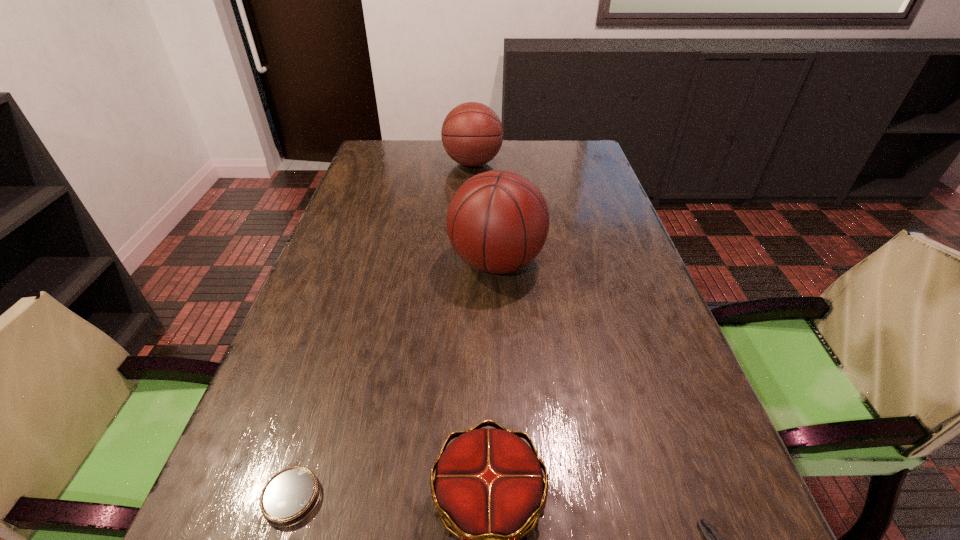
You are a GUI agent. You are given a task and a screenshot of the screen. Output one action in this format:
    pyautogui.click(x=<x>, y=<y>)
    Task: Click on the free space at the far edge
    Image resolution: width=960 pixels, height=540 pixels.
    Given the screenshot: What is the action you would take?
    pyautogui.click(x=411, y=169)

Where is `free region at the left edge`? Image resolution: width=960 pixels, height=540 pixels. free region at the left edge is located at coordinates (291, 389).

Locate an element on the screen. This screenshot has width=960, height=540. free space at the right edge of the desktop is located at coordinates (578, 174).

The image size is (960, 540). Find the location of `vacant area at the far left corner`. vacant area at the far left corner is located at coordinates (391, 144).

Locate an element on the screen. This screenshot has height=540, width=960. vacant space at the far right corner of the desktop is located at coordinates (570, 153).

Where is `vacant region between the compass and the fourth nearest object`? The width and height of the screenshot is (960, 540). vacant region between the compass and the fourth nearest object is located at coordinates (395, 380).

Locate which object is the fourth closest to the leftmost object. Please provide its 2D coordinates. Your answer should be formatted as a tuple, i.e. [(x, y)], where the tuple contains the x and y coordinates of a point satisfying the conditions above.

[(472, 134)]

You are a GUI agent. You are given a task and a screenshot of the screen. Output one action in this format:
    pyautogui.click(x=<x>, y=<y>)
    Task: Click on the object that is the third closest to the rightmost object
    The width and height of the screenshot is (960, 540).
    Given the screenshot: What is the action you would take?
    pyautogui.click(x=290, y=496)